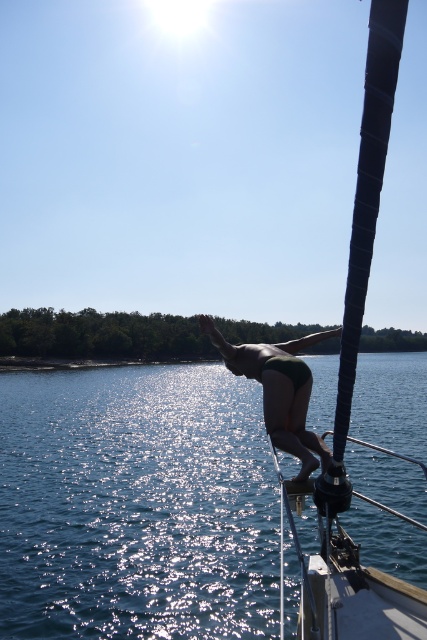
Question: Which of the following is the farthest from the observer?

Choices:
 (A) (281, 420)
 (B) (23, 525)

Answer: (B)

Question: Is shiny blue water at center wider than green matte bikini at center?

Choices:
 (A) yes
 (B) no

Answer: (A)

Question: Can you confirm if shiny blue water at center is smaller than green matte bikini at center?

Choices:
 (A) yes
 (B) no

Answer: (B)

Question: Which point is closer to the camera taking this photo?

Choices:
 (A) (8, 456)
 (B) (233, 348)

Answer: (B)

Question: Which point appears farthest from the camera in this image?

Choices:
 (A) (310, 378)
 (B) (119, 432)

Answer: (B)

Question: In this image, where is shiny blue water at center located relative to green matte bikini at center?

Choices:
 (A) below
 (B) above

Answer: (A)